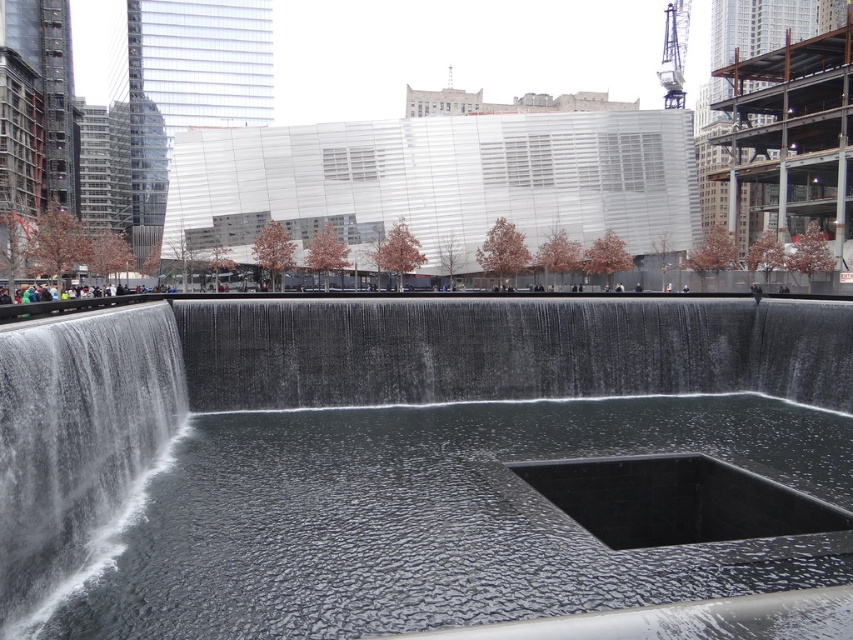
Can you confirm if black polished water at center is positioned above clear water at center?

No, black polished water at center is not above clear water at center.

Can you confirm if black polished water at center is shorter than clear water at center?

No, black polished water at center is not shorter than clear water at center.

Image resolution: width=853 pixels, height=640 pixels. I want to click on black polished water at center, so click(395, 460).

From the picture: Is black polished water at center closer to the viewer compared to white textured water at left?

Yes, black polished water at center is closer to the viewer.

Between point (450, 392) and point (78, 380), which one is positioned behind?

Point (450, 392)

This screenshot has width=853, height=640. Find the location of `black polished water at center`. black polished water at center is located at coordinates (395, 460).

Is clear water at center smaller than white textured water at left?

No, clear water at center is not smaller than white textured water at left.

Does clear water at center appear under white textured water at left?

Incorrect, clear water at center is not positioned below white textured water at left.

The image size is (853, 640). In order to click on clear water at center in this screenshot , I will do `click(508, 349)`.